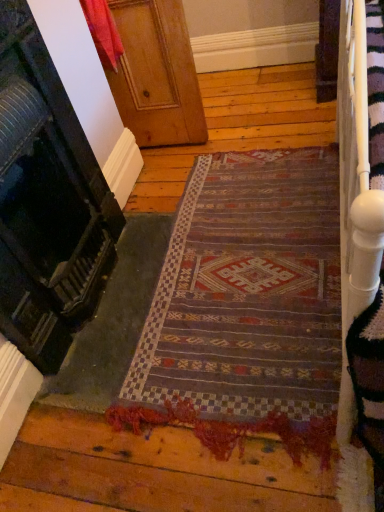
Question: From the image's perspective, is wooden door at upper center, the second door viewed from the top, located beneath wooden at left, which is the second door in bottom-to-top order?

Choices:
 (A) yes
 (B) no

Answer: (A)

Question: From a real-world perspective, is wooden door at upper center, the second door viewed from the top, on wooden at left, the first door positioned from the top?

Choices:
 (A) yes
 (B) no

Answer: (A)

Question: Is wooden door at upper center, the second door viewed from the top, completely or partially outside of wooden at left, which is the second door in bottom-to-top order?

Choices:
 (A) yes
 (B) no

Answer: (A)

Question: Does wooden door at upper center, the 1th door in the bottom-to-top sequence, lie behind wooden at left, which is the second door in bottom-to-top order?

Choices:
 (A) no
 (B) yes

Answer: (A)

Question: Can you confirm if wooden door at upper center, the 1th door in the bottom-to-top sequence, is positioned to the left of wooden at left, which is the second door in bottom-to-top order?

Choices:
 (A) no
 (B) yes

Answer: (B)

Question: Visually, is wooden door at upper center, the second door viewed from the top, positioned to the left or to the right of wooden at left, the first door positioned from the top?

Choices:
 (A) left
 (B) right

Answer: (A)

Question: Considering the positions of point (3, 6) and point (162, 137), is point (3, 6) closer or farther from the camera than point (162, 137)?

Choices:
 (A) closer
 (B) farther

Answer: (A)

Question: Which is correct: wooden door at upper center, the 1th door in the bottom-to-top sequence, is inside wooden at left, which is the second door in bottom-to-top order, or outside of it?

Choices:
 (A) outside
 (B) inside

Answer: (A)

Question: Considering the positions of wooden door at upper center, the second door viewed from the top, and wooden at left, which is the second door in bottom-to-top order, in the image, is wooden door at upper center, the second door viewed from the top, wider or thinner than wooden at left, which is the second door in bottom-to-top order,?

Choices:
 (A) thin
 (B) wide

Answer: (A)

Question: From a real-world perspective, is wooden at left, which is the second door in bottom-to-top order, positioned above or below textured woolen mat at center?

Choices:
 (A) above
 (B) below

Answer: (A)

Question: Is point (173, 66) closer or farther from the camera than point (324, 354)?

Choices:
 (A) farther
 (B) closer

Answer: (A)

Question: In the image, is wooden at left, the first door positioned from the top, positioned in front of or behind textured woolen mat at center?

Choices:
 (A) front
 (B) behind

Answer: (B)

Question: From the image's perspective, is wooden at left, which is the second door in bottom-to-top order, above or below textured woolen mat at center?

Choices:
 (A) above
 (B) below

Answer: (A)

Question: Visually, is textured woolen mat at center positioned to the left or to the right of wooden at left, the first door positioned from the top?

Choices:
 (A) right
 (B) left

Answer: (A)

Question: From a real-world perspective, is textured woolen mat at center above or below wooden at left, which is the second door in bottom-to-top order?

Choices:
 (A) below
 (B) above

Answer: (A)